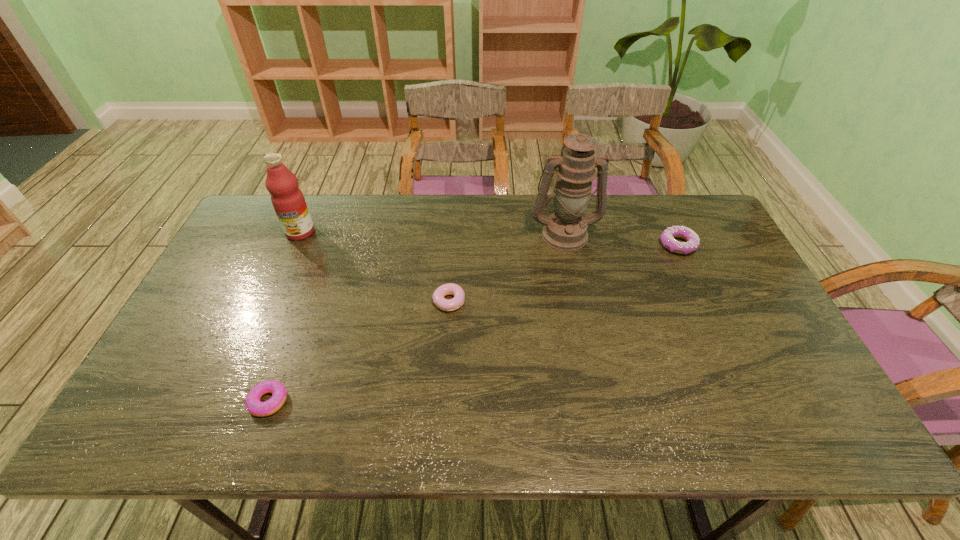
The height and width of the screenshot is (540, 960). I want to click on oil lamp, so click(566, 229).

I want to click on the fourth object from left to right, so click(x=566, y=229).

Find the location of a particular element. fruit juice is located at coordinates (288, 201).

Where is `the leftmost object`? This screenshot has height=540, width=960. the leftmost object is located at coordinates (288, 201).

Identify the location of the farthest doughnut. (692, 243).

Find the location of a particular element. the rightmost object is located at coordinates (692, 243).

This screenshot has height=540, width=960. Identify the location of the second farthest doughnut. (453, 289).

The width and height of the screenshot is (960, 540). In order to click on the fourth tallest object in this screenshot , I will do `click(453, 289)`.

I want to click on the second object from left to right, so click(x=257, y=408).

Where is `the nearest doughnut`? The height and width of the screenshot is (540, 960). the nearest doughnut is located at coordinates (257, 408).